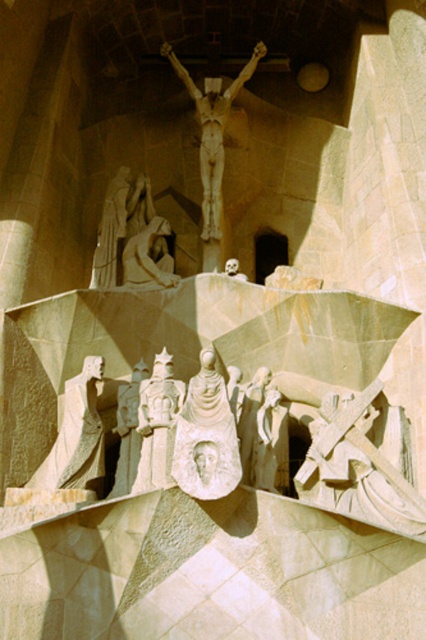
Looking at this image, you are an architect planning to install a new light fixture between the carved stone cross at lower right and the matte stone statue at center. The fixture requires a minimum of 20 feet of space between the two objects to avoid obstruction. Based on the Sagrada Familia scene, will the existing distance accommodate the light fixture?

The distance between the carved stone cross at lower right and the matte stone statue at center is 19.95 feet, which is slightly less than the required 20 feet. Therefore, the existing distance will not accommodate the light fixture without causing an obstruction.

You are an art student analyzing the Sagrada Familia sculpture group. You notice two elements, the carved stone cross at lower right and the smooth beige statue at lower left. Which one is placed below the other?

The carved stone cross at lower right is positioned under the smooth beige statue at lower left.

You are an art student analyzing the Sagrada Familia sculptures. You observe the smooth beige statue at lower left and the matte stone statue at center. Which statue has a greater physical size?

The smooth beige statue at lower left is larger in size than the matte stone statue at center.